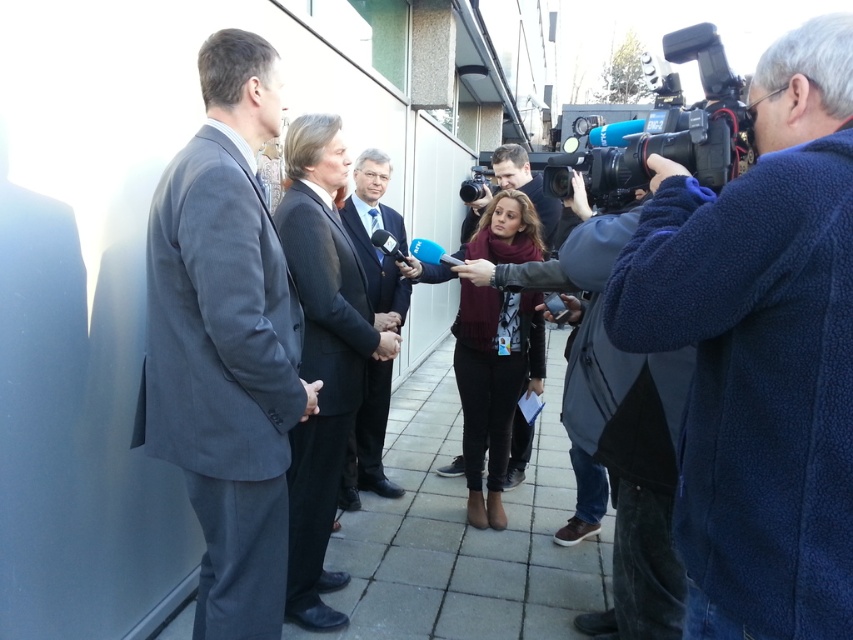
Question: Which point is closer to the camera?

Choices:
 (A) (469, 182)
 (B) (325, 337)

Answer: (B)

Question: Does blue fleece jacket at right have a lesser width compared to dark gray suit at left?

Choices:
 (A) no
 (B) yes

Answer: (B)

Question: Is the position of dark gray suit at left less distant than that of black plastic video camera at center?

Choices:
 (A) yes
 (B) no

Answer: (A)

Question: Is knitted sweater at center wider than black plastic video camera at center?

Choices:
 (A) no
 (B) yes

Answer: (A)

Question: Among these points, which one is nearest to the camera?

Choices:
 (A) click(x=347, y=404)
 (B) click(x=740, y=108)

Answer: (B)

Question: Which object is the farthest from the black plastic video camera at upper right?

Choices:
 (A) black plastic video camera at center
 (B) blue fleece jacket at right

Answer: (A)